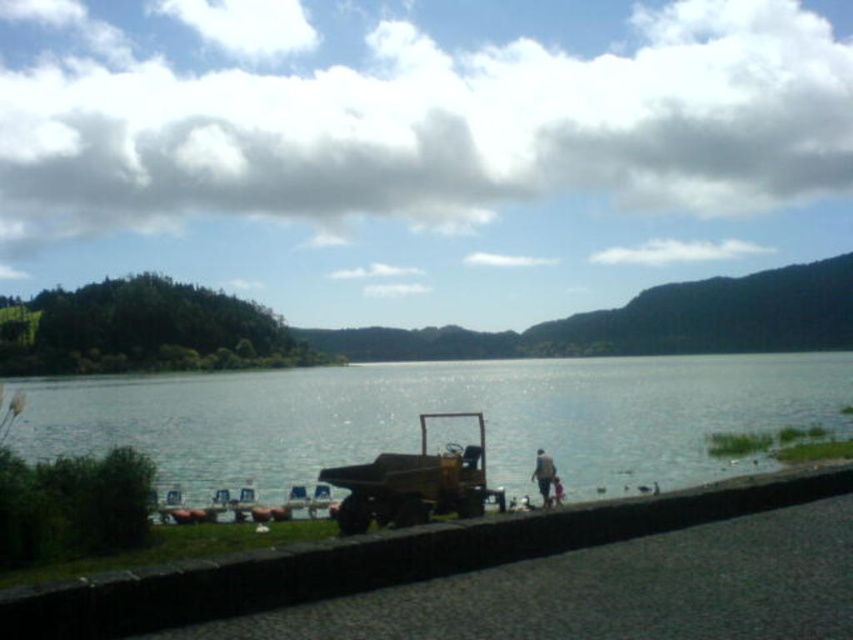
You are a visitor at the lakeside and want to take a photo of the yellow matte truck at center and the brown fabric jacket at lower center. If you position yourself so that the truck is on your left side, will the jacket appear to your right side in the photo?

Yes, the jacket will appear to your right side because the yellow matte truck at center is to the left of brown fabric jacket at lower center.

You are standing on the lakeside path and see the clear water at lower center and the brown fabric jacket at lower center. Which object is closer to the bottom edge of the image?

The clear water at lower center is closer to the bottom edge of the image because it is positioned below the brown fabric jacket at lower center.

You are standing at the center of the image and want to walk to the clear water at lower center. Which direction should you move? Please provide your answer in terms of cardinal directions and distance in meters, assuming the image is 1 meter wide and 1 meter tall.

The clear water at lower center is located at coordinates 0.642 meters to the right and 0.518 meters downward from the center. To reach it, move 0.642 meters to the east and 0.518 meters to the south.